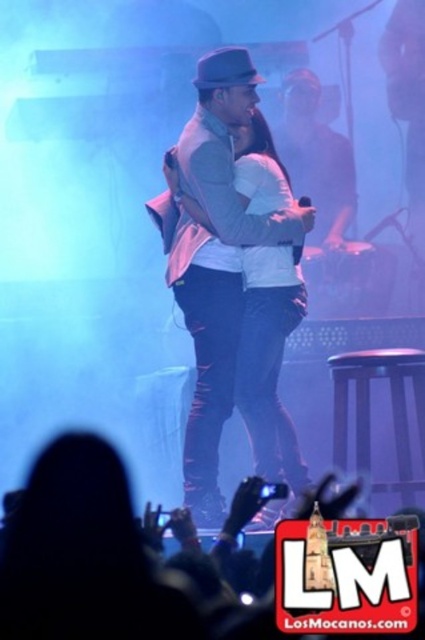
You are a stagehand at the concert and need to place a spotlight on the stage. There are two points marked on the stage floor where you can position it. The first point is at coordinate point(204, 380) and the second is at coordinate point(371, 349). Which point is closer to the front of the stage?

Point(204, 380) is in front of point(371, 349), so the first point is closer to the front of the stage.

You are a stagehand who needs to place a microphone stand that is 1.2 meters tall. You see the brown wooden stool at lower right and the matte black fedora at upper center. Which object is taller and can accommodate the microphone stand?

The brown wooden stool at lower right is much taller than the matte black fedora at upper center. Since the stool is taller, it can accommodate the microphone stand of 1.2 meters if its height is sufficient. However, the description only states the stool is taller than the fedora, but does not provide exact measurements for the stool. Therefore, we cannot confirm if it meets the required height for the microphone stand.